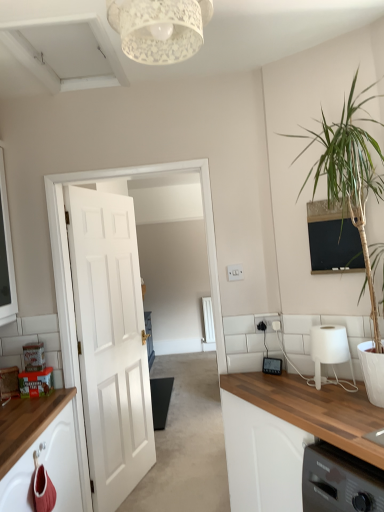
Describe the element at coordinates (351, 195) in the screenshot. I see `green leafy plant at right` at that location.

What do you see at coordinates (159, 28) in the screenshot?
I see `white lace lampshade at upper center` at bounding box center [159, 28].

Locate an element on the screen. white glossy door at center is located at coordinates (67, 249).

The image size is (384, 512). What do you see at coordinates (330, 351) in the screenshot? I see `white matte lamp at right` at bounding box center [330, 351].

The height and width of the screenshot is (512, 384). I want to click on white painted wood door at left, so click(110, 342).

Which of these two, white glossy door at center or matte black thermostat at center, stands shorter?

matte black thermostat at center.

Considering the relative positions of white glossy door at center and matte black thermostat at center in the image provided, is white glossy door at center behind matte black thermostat at center?

Yes, white glossy door at center is behind matte black thermostat at center.

Between point (183, 167) and point (264, 358), which one is positioned behind?

Positioned behind is point (183, 167).

Considering the relative sizes of white glossy door at center and matte black thermostat at center in the image provided, is white glossy door at center smaller than matte black thermostat at center?

Incorrect, white glossy door at center is not smaller in size than matte black thermostat at center.

The width and height of the screenshot is (384, 512). I want to click on home appliance located behind the white matte lamp at right, so (272, 366).

Is there a large distance between matte black thermostat at center and white matte lamp at right?

No, matte black thermostat at center is not far from white matte lamp at right.

Can you confirm if matte black thermostat at center is taller than white matte lamp at right?

No.

Considering the positions of points (269, 367) and (341, 356), is point (269, 367) closer to camera compared to point (341, 356)?

No, (269, 367) is behind (341, 356).

Considering the points (64, 366) and (127, 337), which point is behind, point (64, 366) or point (127, 337)?

The point (127, 337) is farther from the camera.

Relative to white painted wood door at left, is white glossy door at center in front or behind?

white glossy door at center is in front of white painted wood door at left.

From the picture: From a real-world perspective, which object rests below the other?

From a 3D spatial view, white painted wood door at left is below.

Can you confirm if white glossy door at center is taller than white painted wood door at left?

In fact, white glossy door at center may be shorter than white painted wood door at left.

There is a white matte lamp at right. Where is `light fixture above it (from a real-world perspective)`? light fixture above it (from a real-world perspective) is located at coordinates (159, 28).

Is white matte lamp at right to the right of white lace lampshade at upper center from the viewer's perspective?

Indeed, white matte lamp at right is positioned on the right side of white lace lampshade at upper center.

From the image's perspective, who appears lower, white matte lamp at right or white lace lampshade at upper center?

white matte lamp at right, from the image's perspective.

Is white glossy door at center to the left or to the right of white lace lampshade at upper center in the image?

In the image, white glossy door at center appears on the left side of white lace lampshade at upper center.

Is white glossy door at center next to white lace lampshade at upper center and touching it?

white glossy door at center and white lace lampshade at upper center are not in contact.

Considering the sizes of white glossy door at center and white lace lampshade at upper center in the image, is white glossy door at center taller or shorter than white lace lampshade at upper center?

In the image, white glossy door at center appears to be taller than white lace lampshade at upper center.

Can you confirm if white glossy door at center is smaller than white lace lampshade at upper center?

No, white glossy door at center is not smaller than white lace lampshade at upper center.

From a real-world perspective, between green leafy plant at right and white glossy door at center, who is vertically lower?

white glossy door at center.

Considering the sizes of green leafy plant at right and white glossy door at center in the image, is green leafy plant at right bigger or smaller than white glossy door at center?

Clearly, green leafy plant at right is larger in size than white glossy door at center.

The width and height of the screenshot is (384, 512). I want to click on houseplant that is on the right side of white glossy door at center, so click(x=351, y=195).

Can you confirm if white painted wood door at left is thinner than white glossy door at center?

No, white painted wood door at left is not thinner than white glossy door at center.

How far apart are white painted wood door at left and white glossy door at center?

white painted wood door at left is 50.24 centimeters away from white glossy door at center.

Between white painted wood door at left and white glossy door at center, which one appears on the left side from the viewer's perspective?

Positioned to the left is white painted wood door at left.

Is white painted wood door at left far away from white glossy door at center?

white painted wood door at left is actually quite close to white glossy door at center.

This screenshot has height=512, width=384. Identify the location of home appliance below the white glossy door at center (from the image's perspective). (272, 366).

Locate an element on the screen. This screenshot has width=384, height=512. home appliance on the left of white matte lamp at right is located at coordinates (272, 366).

Looking at the image, which one is located further to white glossy door at center, white matte lamp at right or green leafy plant at right?

The object further to white glossy door at center is green leafy plant at right.

Looking at the image, which one is located closer to white glossy door at center, green leafy plant at right or white lace lampshade at upper center?

green leafy plant at right is positioned closer to the anchor white glossy door at center.

Based on their spatial positions, is white glossy door at center or matte black thermostat at center further from green leafy plant at right?

matte black thermostat at center is positioned further to the anchor green leafy plant at right.

In the scene shown: Based on their spatial positions, is white matte lamp at right or matte black thermostat at center closer to white glossy door at center?

white matte lamp at right is positioned closer to the anchor white glossy door at center.

Looking at the image, which one is located closer to green leafy plant at right, white matte lamp at right or white lace lampshade at upper center?

white matte lamp at right lies closer to green leafy plant at right than the other object.

From the image, which object appears to be farther from white matte lamp at right, white glossy door at center or matte black thermostat at center?

Among the two, white glossy door at center is located further to white matte lamp at right.

Looking at the image, which one is located closer to white lace lampshade at upper center, white painted wood door at left or white matte lamp at right?

Among the two, white matte lamp at right is located nearer to white lace lampshade at upper center.

Based on their spatial positions, is matte black thermostat at center or white glossy door at center closer to white painted wood door at left?

white glossy door at center.

Locate an element on the screen. The width and height of the screenshot is (384, 512). home appliance positioned between white lace lampshade at upper center and white glossy door at center from near to far is located at coordinates (272, 366).

Locate an element on the screen. This screenshot has height=512, width=384. houseplant between white lace lampshade at upper center and white matte lamp at right vertically is located at coordinates (351, 195).

Locate an element on the screen. Image resolution: width=384 pixels, height=512 pixels. home appliance between white glossy door at center and green leafy plant at right from left to right is located at coordinates (272, 366).

The height and width of the screenshot is (512, 384). Identify the location of appliance between green leafy plant at right and matte black thermostat at center from top to bottom. (330, 351).